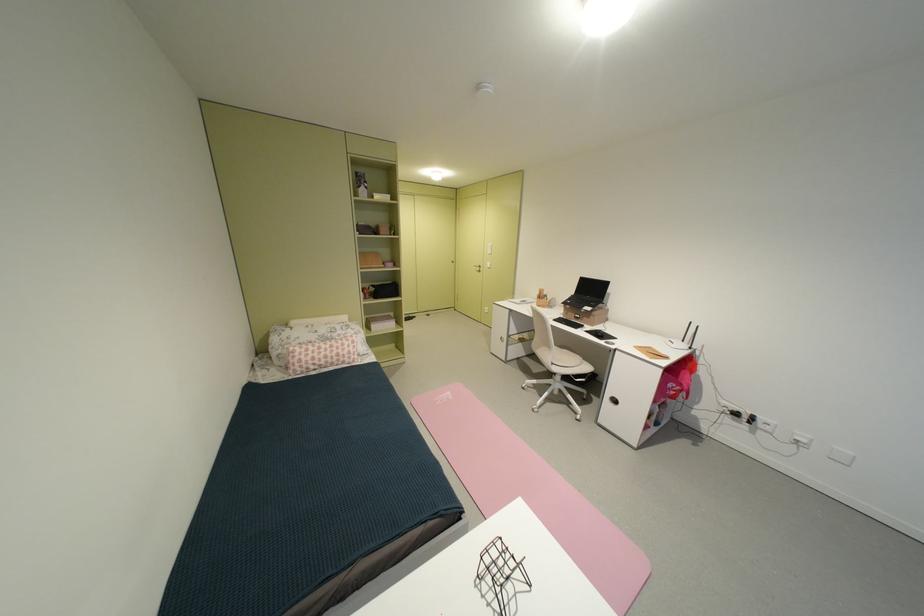
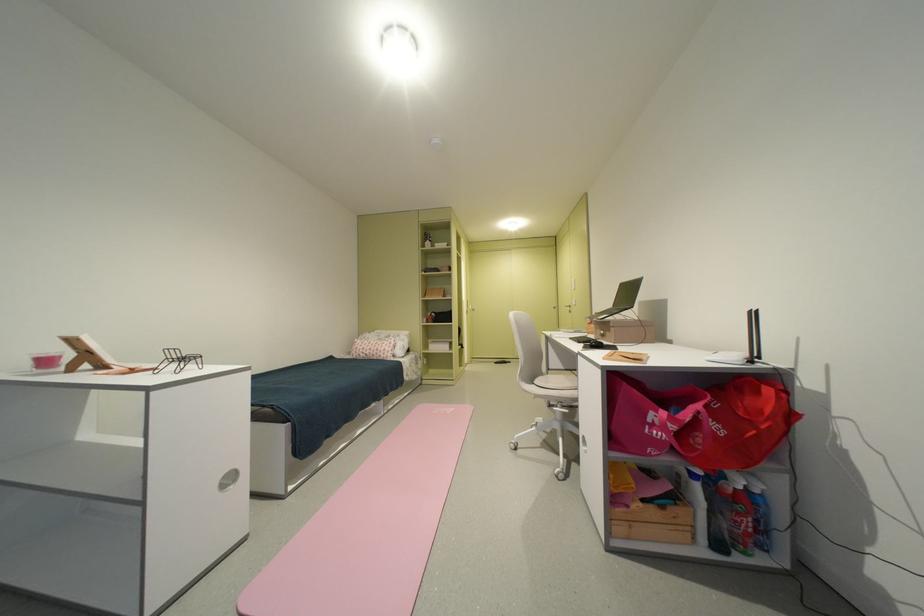
In the second image, find the point that corresponds to the point at 563,363 in the first image.

(543, 383)